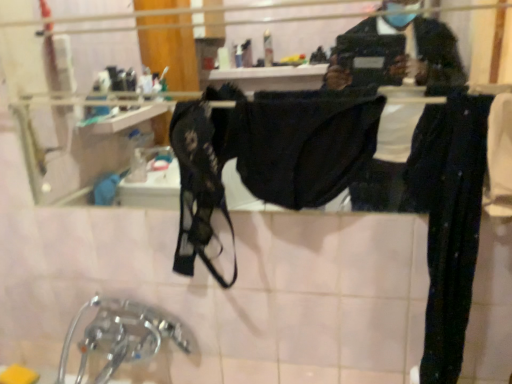
Question: Should I look upward or downward to see chrome metallic faucet at lower left?

Choices:
 (A) up
 (B) down

Answer: (B)